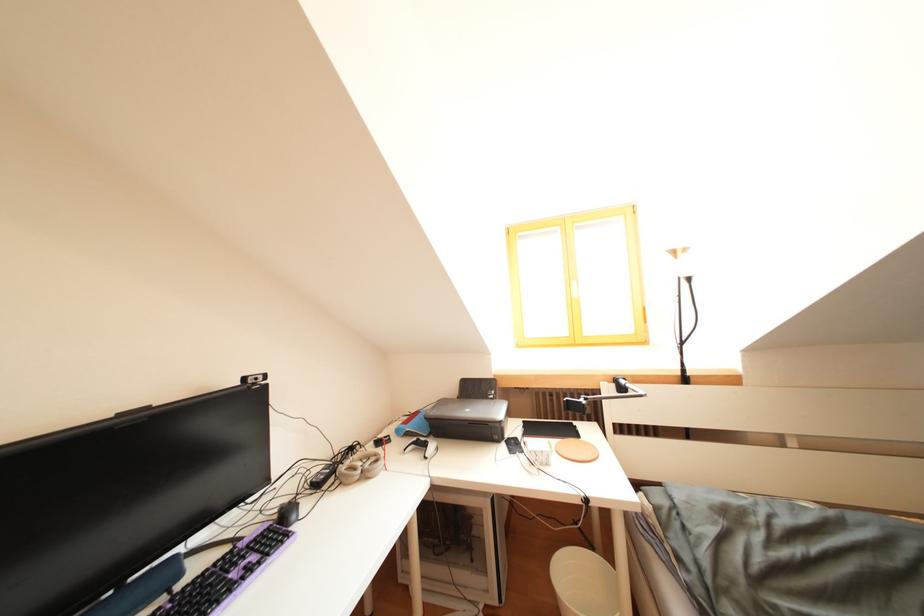
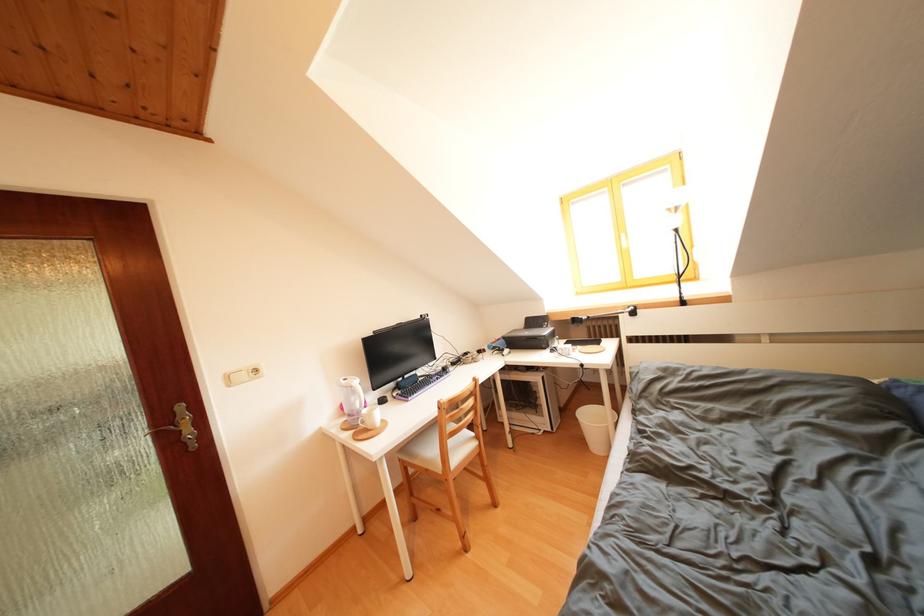
Question: Based on the continuous images, in which direction is the camera rotating? Reply with the corresponding letter.

Choices:
 (A) Left
 (B) Right
 (C) Up
 (D) Down

Answer: (A)